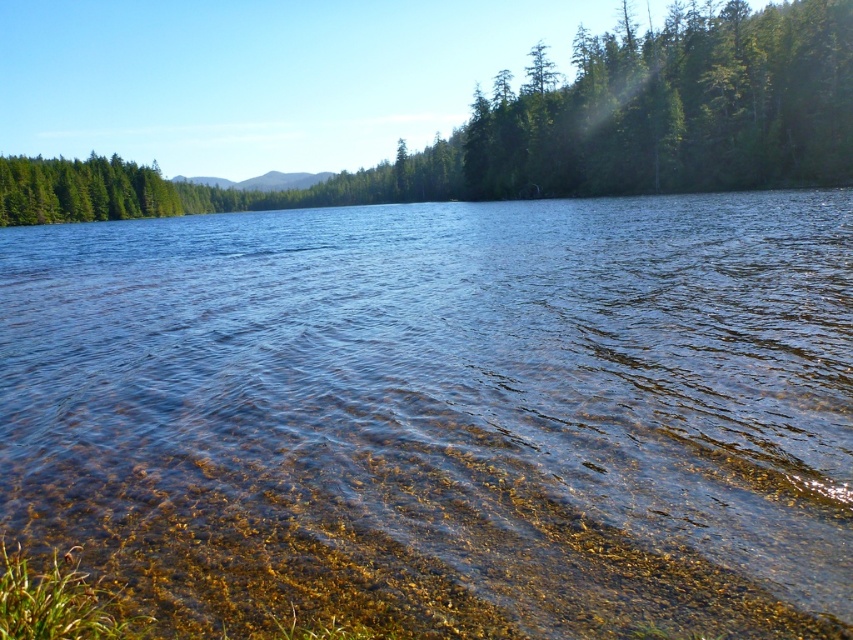
Question: In this image, where is clear water at center located relative to green matte tree at upper center?

Choices:
 (A) above
 (B) below

Answer: (B)

Question: Which object appears closest to the camera in this image?

Choices:
 (A) green matte tree at upper center
 (B) clear water at center

Answer: (B)

Question: Which point is closer to the camera?

Choices:
 (A) green matte tree at upper center
 (B) clear water at center

Answer: (B)

Question: Observing the image, what is the correct spatial positioning of clear water at center in reference to green matte tree at upper center?

Choices:
 (A) above
 (B) below

Answer: (B)

Question: Among these points, which one is farthest from the camera?

Choices:
 (A) [799, 118]
 (B) [198, 353]

Answer: (A)

Question: In this image, where is clear water at center located relative to green matte tree at upper center?

Choices:
 (A) below
 (B) above

Answer: (A)